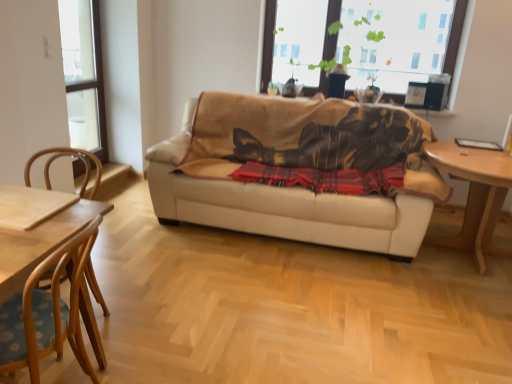
What do you see at coordinates (286, 188) in the screenshot?
I see `beige leather couch at center` at bounding box center [286, 188].

Describe the element at coordinates (324, 178) in the screenshot. I see `red plaid blanket at center` at that location.

Measure the distance between point (439, 236) and camera.

The distance of point (439, 236) from camera is 11.19 feet.

This screenshot has height=384, width=512. What do you see at coordinates (84, 75) in the screenshot?
I see `transparent glass window at upper left, the first window from the left` at bounding box center [84, 75].

I want to click on light wood chair at left, the 2th chair in the front-to-back sequence, so click(x=68, y=155).

Is beige leather couch at center completely or partially inside transparent glass window at upper left, the second window viewed from the right?

No.

Could you tell me if transparent glass window at upper left, the second window viewed from the right, is turned towards beige leather couch at center?

Yes, transparent glass window at upper left, the second window viewed from the right, is oriented towards beige leather couch at center.

Considering the sizes of objects transparent glass window at upper left, the second window viewed from the right, and beige leather couch at center in the image provided, who is taller, transparent glass window at upper left, the second window viewed from the right, or beige leather couch at center?

Standing taller between the two is transparent glass window at upper left, the second window viewed from the right.

From the image's perspective, is beige leather couch at center located beneath red plaid blanket at center?

No.

Considering the relative sizes of beige leather couch at center and red plaid blanket at center in the image provided, is beige leather couch at center taller than red plaid blanket at center?

Indeed, beige leather couch at center has a greater height compared to red plaid blanket at center.

Based on the photo, does beige leather couch at center appear on the left side of red plaid blanket at center?

Correct, you'll find beige leather couch at center to the left of red plaid blanket at center.

From a real-world perspective, is beige leather couch at center physically located above or below red plaid blanket at center?

Clearly, from a real-world perspective, beige leather couch at center is below red plaid blanket at center.

Does wooden chair at left, the 1th chair positioned from the front, have a lesser height compared to light wood chair at left, which is counted as the first chair, starting from the back?

Indeed, wooden chair at left, the 1th chair positioned from the front, has a lesser height compared to light wood chair at left, which is counted as the first chair, starting from the back.

Would you say wooden chair at left, which is counted as the second chair, starting from the back, is inside or outside light wood chair at left, which is counted as the first chair, starting from the back?

The correct answer is: outside.

From the picture: In terms of size, does wooden chair at left, which is counted as the second chair, starting from the back, appear bigger or smaller than light wood chair at left, which is counted as the first chair, starting from the back?

Considering their sizes, wooden chair at left, which is counted as the second chair, starting from the back, takes up more space than light wood chair at left, which is counted as the first chair, starting from the back.

Which is in front, wooden chair at left, the 1th chair positioned from the front, or light wood chair at left, which is counted as the first chair, starting from the back?

wooden chair at left, the 1th chair positioned from the front, is in front.

Is wooden chair at left, the 1th chair positioned from the front, oriented away from beige leather couch at center?

wooden chair at left, the 1th chair positioned from the front, does not have its back to beige leather couch at center.

Does point (27, 362) appear closer or farther from the camera than point (307, 238)?

Clearly, point (27, 362) is closer to the camera than point (307, 238).

This screenshot has width=512, height=384. What are the coordinates of `studio couch on the right of wooden chair at left, which is counted as the second chair, starting from the back` in the screenshot? It's located at (286, 188).

Which object is more forward, wooden chair at left, the 1th chair positioned from the front, or beige leather couch at center?

wooden chair at left, the 1th chair positioned from the front.

From a real-world perspective, is transparent glass window at upper center, arranged as the first window when viewed from the right, over beige leather couch at center?

Correct, in the physical world, transparent glass window at upper center, arranged as the first window when viewed from the right, is higher than beige leather couch at center.

Considering the sizes of objects transparent glass window at upper center, the second window positioned from the left, and beige leather couch at center in the image provided, who is shorter, transparent glass window at upper center, the second window positioned from the left, or beige leather couch at center?

Standing shorter between the two is transparent glass window at upper center, the second window positioned from the left.

Does transparent glass window at upper center, the second window positioned from the left, turn towards beige leather couch at center?

No, transparent glass window at upper center, the second window positioned from the left, is not oriented towards beige leather couch at center.

Which is correct: transparent glass window at upper center, the second window positioned from the left, is inside beige leather couch at center, or outside of it?

transparent glass window at upper center, the second window positioned from the left, is located beyond the bounds of beige leather couch at center.

Does red plaid blanket at center touch beige leather couch at center?

There is a gap between red plaid blanket at center and beige leather couch at center.

Is red plaid blanket at center aimed at beige leather couch at center?

Yes, red plaid blanket at center is turned towards beige leather couch at center.

Can you confirm if red plaid blanket at center is bigger than beige leather couch at center?

Actually, red plaid blanket at center might be smaller than beige leather couch at center.

From a real-world perspective, is red plaid blanket at center above or below beige leather couch at center?

From a real-world perspective, red plaid blanket at center is physically above beige leather couch at center.

Can you tell me how much transparent glass window at upper left, the first window from the left, and light brown wooden table at right differ in facing direction?

89.7 degrees.

Who is bigger, transparent glass window at upper left, the first window from the left, or light brown wooden table at right?

light brown wooden table at right.

Is transparent glass window at upper left, the first window from the left, situated inside light brown wooden table at right or outside?

The correct answer is: outside.

This screenshot has width=512, height=384. In order to click on studio couch below the transparent glass window at upper left, the second window viewed from the right (from the image's perspective) in this screenshot , I will do `click(286, 188)`.

You are a GUI agent. You are given a task and a screenshot of the screen. Output one action in this format:
    pyautogui.click(x=<x>, y=<y>)
    Task: Click on the plaid that appears behind the beige leather couch at center
    The width and height of the screenshot is (512, 384).
    Given the screenshot: What is the action you would take?
    pyautogui.click(x=324, y=178)

Looking at the image, which one is located closer to transparent glass window at upper left, the second window viewed from the right, beige leather couch at center or wooden chair at left, the 1th chair positioned from the front?

The object closer to transparent glass window at upper left, the second window viewed from the right, is beige leather couch at center.

Looking at the image, which one is located closer to transparent glass window at upper center, arranged as the first window when viewed from the right, light brown wooden table at right or wooden chair at left, which is counted as the second chair, starting from the back?

light brown wooden table at right is closer to transparent glass window at upper center, arranged as the first window when viewed from the right.

Looking at the image, which one is located further to beige leather couch at center, light wood chair at left, the 2th chair in the front-to-back sequence, or light brown wooden table at right?

The object further to beige leather couch at center is light wood chair at left, the 2th chair in the front-to-back sequence.

Looking at the image, which one is located closer to red plaid blanket at center, beige leather couch at center or wooden chair at left, the 1th chair positioned from the front?

beige leather couch at center.

Considering their positions, is red plaid blanket at center positioned further to beige leather couch at center than light wood chair at left, which is counted as the first chair, starting from the back?

Among the two, light wood chair at left, which is counted as the first chair, starting from the back, is located further to beige leather couch at center.

Considering their positions, is transparent glass window at upper center, arranged as the first window when viewed from the right, positioned further to light wood chair at left, the 2th chair in the front-to-back sequence, than red plaid blanket at center?

transparent glass window at upper center, arranged as the first window when viewed from the right, is positioned further to the anchor light wood chair at left, the 2th chair in the front-to-back sequence.

Looking at the image, which one is located further to transparent glass window at upper center, the second window positioned from the left, wooden chair at left, which is counted as the second chair, starting from the back, or red plaid blanket at center?

wooden chair at left, which is counted as the second chair, starting from the back, lies further to transparent glass window at upper center, the second window positioned from the left, than the other object.

Estimate the real-world distances between objects in this image. Which object is closer to transparent glass window at upper center, arranged as the first window when viewed from the right, light wood chair at left, which is counted as the first chair, starting from the back, or transparent glass window at upper left, the first window from the left?

The object closer to transparent glass window at upper center, arranged as the first window when viewed from the right, is transparent glass window at upper left, the first window from the left.

The image size is (512, 384). In order to click on plaid between wooden chair at left, which is counted as the second chair, starting from the back, and transparent glass window at upper left, the second window viewed from the right, along the z-axis in this screenshot , I will do `click(324, 178)`.

Locate an element on the screen. studio couch between transparent glass window at upper center, the second window positioned from the left, and light brown wooden table at right, in the vertical direction is located at coordinates (286, 188).

This screenshot has width=512, height=384. I want to click on chair between wooden chair at left, the 1th chair positioned from the front, and red plaid blanket at center from left to right, so click(68, 155).

The width and height of the screenshot is (512, 384). I want to click on chair between wooden chair at left, which is counted as the second chair, starting from the back, and light brown wooden table at right, in the horizontal direction, so click(x=68, y=155).